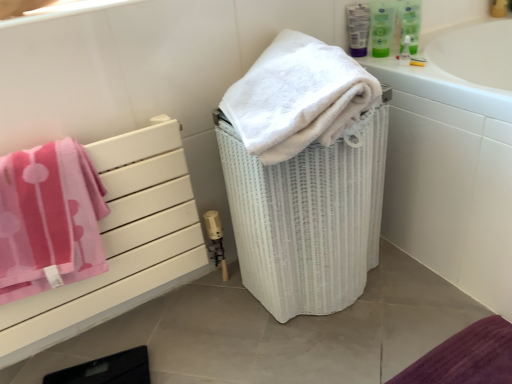
The height and width of the screenshot is (384, 512). In order to click on translucent plastic mouthwash at upper right, which is the 1th mouthwash in left-to-right order in this screenshot , I will do `click(358, 29)`.

How much space does translucent plastic mouthwash at upper right, which is the 1th mouthwash in left-to-right order, occupy horizontally?

1.83 inches.

Locate an element on the screen. The image size is (512, 384). pink terry cloth towel at left, positioned as the 1th towel in left-to-right order is located at coordinates (49, 219).

Measure the distance between point (5, 222) and camera.

Point (5, 222) and camera are 85.50 centimeters apart.

Measure the distance between white glossy bathtub at upper right and camera.

The depth of white glossy bathtub at upper right is 34.99 inches.

This screenshot has width=512, height=384. What do you see at coordinates (382, 26) in the screenshot? I see `green plastic mouthwash at upper right, which appears as the 2th mouthwash when viewed from the right` at bounding box center [382, 26].

Locate an element on the screen. Image resolution: width=512 pixels, height=384 pixels. translucent plastic mouthwash at upper right, which is the 1th mouthwash in left-to-right order is located at coordinates (358, 29).

Would you say translucent plastic mouthwash at upper right, which is the 1th mouthwash in left-to-right order, is outside pink terry cloth towel at left, positioned as the 1th towel in left-to-right order?

Indeed, translucent plastic mouthwash at upper right, which is the 1th mouthwash in left-to-right order, is completely outside pink terry cloth towel at left, positioned as the 1th towel in left-to-right order.

Relative to pink terry cloth towel at left, positioned as the 1th towel in left-to-right order, is translucent plastic mouthwash at upper right, acting as the third mouthwash starting from the right, in front or behind?

translucent plastic mouthwash at upper right, acting as the third mouthwash starting from the right, is behind pink terry cloth towel at left, positioned as the 1th towel in left-to-right order.

In the scene shown: Considering the sizes of objects translucent plastic mouthwash at upper right, which is the 1th mouthwash in left-to-right order, and pink terry cloth towel at left, which appears as the second towel when viewed from the right, in the image provided, who is wider, translucent plastic mouthwash at upper right, which is the 1th mouthwash in left-to-right order, or pink terry cloth towel at left, which appears as the second towel when viewed from the right,?

pink terry cloth towel at left, which appears as the second towel when viewed from the right, is wider.

In terms of height, does green plastic mouthwash at upper right, which appears as the 2th mouthwash when viewed from the right, look taller or shorter compared to pink terry cloth towel at left, positioned as the 1th towel in left-to-right order?

In the image, green plastic mouthwash at upper right, which appears as the 2th mouthwash when viewed from the right, appears to be shorter than pink terry cloth towel at left, positioned as the 1th towel in left-to-right order.

Considering the positions of objects green plastic mouthwash at upper right, which appears as the 2th mouthwash when viewed from the right, and pink terry cloth towel at left, which appears as the second towel when viewed from the right, in the image provided, who is more to the right, green plastic mouthwash at upper right, which appears as the 2th mouthwash when viewed from the right, or pink terry cloth towel at left, which appears as the second towel when viewed from the right,?

green plastic mouthwash at upper right, which appears as the 2th mouthwash when viewed from the right.

Which mouthwash is the 2nd one when counting from the right side of the pink terry cloth towel at left, which appears as the second towel when viewed from the right? Please provide its 2D coordinates.

[(382, 26)]

Considering the relative sizes of green plastic mouthwash at upper right, arranged as the 2th mouthwash when viewed from the left, and pink terry cloth towel at left, which appears as the second towel when viewed from the right, in the image provided, is green plastic mouthwash at upper right, arranged as the 2th mouthwash when viewed from the left, wider than pink terry cloth towel at left, which appears as the second towel when viewed from the right,?

In fact, green plastic mouthwash at upper right, arranged as the 2th mouthwash when viewed from the left, might be narrower than pink terry cloth towel at left, which appears as the second towel when viewed from the right.

From a real-world perspective, is translucent plastic mouthwash at upper right, acting as the third mouthwash starting from the right, physically located above or below white glossy bathtub at upper right?

From a real-world perspective, translucent plastic mouthwash at upper right, acting as the third mouthwash starting from the right, is physically above white glossy bathtub at upper right.

Is translucent plastic mouthwash at upper right, acting as the third mouthwash starting from the right, inside the boundaries of white glossy bathtub at upper right, or outside?

translucent plastic mouthwash at upper right, acting as the third mouthwash starting from the right, cannot be found inside white glossy bathtub at upper right.

From the image's perspective, does translucent plastic mouthwash at upper right, acting as the third mouthwash starting from the right, appear higher than white glossy bathtub at upper right?

Correct, translucent plastic mouthwash at upper right, acting as the third mouthwash starting from the right, appears higher than white glossy bathtub at upper right in the image.

Considering the relative sizes of translucent plastic mouthwash at upper right, which is the 1th mouthwash in left-to-right order, and white glossy bathtub at upper right in the image provided, is translucent plastic mouthwash at upper right, which is the 1th mouthwash in left-to-right order, bigger than white glossy bathtub at upper right?

No, translucent plastic mouthwash at upper right, which is the 1th mouthwash in left-to-right order, is not bigger than white glossy bathtub at upper right.

Which is in front, point (195, 233) or point (356, 51)?

The point (195, 233) is in front.

Considering the relative sizes of pink fabric towel at left and translucent plastic mouthwash at upper right, which is the 1th mouthwash in left-to-right order, in the image provided, is pink fabric towel at left smaller than translucent plastic mouthwash at upper right, which is the 1th mouthwash in left-to-right order,?

No.

Would you say pink fabric towel at left is inside or outside translucent plastic mouthwash at upper right, which is the 1th mouthwash in left-to-right order?

pink fabric towel at left is not enclosed by translucent plastic mouthwash at upper right, which is the 1th mouthwash in left-to-right order.

The image size is (512, 384). I want to click on drawer that appears below the translucent plastic mouthwash at upper right, which is the 1th mouthwash in left-to-right order (from the image's perspective), so click(120, 243).

Considering the sizes of objects pink fabric towel at left and green plastic mouthwash at upper right, which appears as the 2th mouthwash when viewed from the right, in the image provided, who is thinner, pink fabric towel at left or green plastic mouthwash at upper right, which appears as the 2th mouthwash when viewed from the right,?

With smaller width is green plastic mouthwash at upper right, which appears as the 2th mouthwash when viewed from the right.

Where is `the 1st mouthwash above the pink fabric towel at left (from the image's perspective)`? the 1st mouthwash above the pink fabric towel at left (from the image's perspective) is located at coordinates (382, 26).

Measure the distance between pink fabric towel at left and green plastic mouthwash at upper right, which appears as the 2th mouthwash when viewed from the right.

34.12 inches.

Is pink fabric towel at left placed right next to green plastic mouthwash at upper right, arranged as the 2th mouthwash when viewed from the left?

No, pink fabric towel at left is not next to green plastic mouthwash at upper right, arranged as the 2th mouthwash when viewed from the left.

Is pink terry cloth towel at left, which appears as the second towel when viewed from the right, with white wicker laundry basket at center?

No, pink terry cloth towel at left, which appears as the second towel when viewed from the right, is not making contact with white wicker laundry basket at center.

Does pink terry cloth towel at left, positioned as the 1th towel in left-to-right order, contain white wicker laundry basket at center?

Actually, white wicker laundry basket at center is outside pink terry cloth towel at left, positioned as the 1th towel in left-to-right order.

From the image's perspective, which is below, pink terry cloth towel at left, positioned as the 1th towel in left-to-right order, or white wicker laundry basket at center?

From the image's view, pink terry cloth towel at left, positioned as the 1th towel in left-to-right order, is below.

Does pink terry cloth towel at left, which appears as the second towel when viewed from the right, come behind white wicker laundry basket at center?

No, the depth of pink terry cloth towel at left, which appears as the second towel when viewed from the right, is less than that of white wicker laundry basket at center.

Consider the image. From the image's perspective, does green plastic mouthwash at upper right, which appears as the 2th mouthwash when viewed from the right, appear lower than green plastic mouthwash at upper right, acting as the 1th mouthwash starting from the right?

Correct, green plastic mouthwash at upper right, which appears as the 2th mouthwash when viewed from the right, appears lower than green plastic mouthwash at upper right, acting as the 1th mouthwash starting from the right, in the image.

Between green plastic mouthwash at upper right, arranged as the 2th mouthwash when viewed from the left, and green plastic mouthwash at upper right, acting as the 1th mouthwash starting from the right, which one has more height?

green plastic mouthwash at upper right, acting as the 1th mouthwash starting from the right, is taller.

Which is more to the left, green plastic mouthwash at upper right, arranged as the 2th mouthwash when viewed from the left, or green plastic mouthwash at upper right, arranged as the third mouthwash when viewed from the left?

Positioned to the left is green plastic mouthwash at upper right, arranged as the 2th mouthwash when viewed from the left.

You are a GUI agent. You are given a task and a screenshot of the screen. Output one action in this format:
    pyautogui.click(x=<x>, y=<y>)
    Task: Click on the towel that is the 1st object located in front of the translucent plastic mouthwash at upper right, which is the 1th mouthwash in left-to-right order
    The image size is (512, 384).
    Given the screenshot: What is the action you would take?
    pyautogui.click(x=49, y=219)

Where is `the 2nd towel below the green plastic mouthwash at upper right, arranged as the 2th mouthwash when viewed from the left (from the image's perspective)`? The image size is (512, 384). the 2nd towel below the green plastic mouthwash at upper right, arranged as the 2th mouthwash when viewed from the left (from the image's perspective) is located at coordinates (49, 219).

Looking at this image, from the image, which object appears to be nearer to green plastic mouthwash at upper right, acting as the 1th mouthwash starting from the right, white fluffy towel at upper right, positioned as the second towel in left-to-right order, or white glossy bathtub at upper right?

white glossy bathtub at upper right is closer to green plastic mouthwash at upper right, acting as the 1th mouthwash starting from the right.

From the image, which object appears to be farther from green plastic mouthwash at upper right, arranged as the third mouthwash when viewed from the left, translucent plastic mouthwash at upper right, acting as the third mouthwash starting from the right, or pink fabric towel at left?

pink fabric towel at left lies further to green plastic mouthwash at upper right, arranged as the third mouthwash when viewed from the left, than the other object.

Based on the photo, based on their spatial positions, is pink terry cloth towel at left, positioned as the 1th towel in left-to-right order, or white glossy bathtub at upper right further from white fluffy towel at upper right, which ranks as the first towel in right-to-left order?

pink terry cloth towel at left, positioned as the 1th towel in left-to-right order, is further to white fluffy towel at upper right, which ranks as the first towel in right-to-left order.

Based on their spatial positions, is white fluffy towel at upper right, which ranks as the first towel in right-to-left order, or pink terry cloth towel at left, which appears as the second towel when viewed from the right, closer to white glossy bathtub at upper right?

Among the two, white fluffy towel at upper right, which ranks as the first towel in right-to-left order, is located nearer to white glossy bathtub at upper right.

Based on their spatial positions, is green plastic mouthwash at upper right, which appears as the 2th mouthwash when viewed from the right, or translucent plastic mouthwash at upper right, acting as the third mouthwash starting from the right, closer to white wicker laundry basket at center?

green plastic mouthwash at upper right, which appears as the 2th mouthwash when viewed from the right, is closer to white wicker laundry basket at center.

When comparing their distances from white wicker laundry basket at center, does green plastic mouthwash at upper right, which appears as the 2th mouthwash when viewed from the right, or green plastic mouthwash at upper right, arranged as the third mouthwash when viewed from the left, seem closer?

green plastic mouthwash at upper right, arranged as the third mouthwash when viewed from the left, is positioned closer to the anchor white wicker laundry basket at center.

Consider the image. Considering their positions, is pink terry cloth towel at left, which appears as the second towel when viewed from the right, positioned closer to pink fabric towel at left than green plastic mouthwash at upper right, arranged as the third mouthwash when viewed from the left?

pink terry cloth towel at left, which appears as the second towel when viewed from the right, is positioned closer to the anchor pink fabric towel at left.

Looking at the image, which one is located further to white glossy bathtub at upper right, green plastic mouthwash at upper right, which appears as the 2th mouthwash when viewed from the right, or green plastic mouthwash at upper right, acting as the 1th mouthwash starting from the right?

green plastic mouthwash at upper right, which appears as the 2th mouthwash when viewed from the right, is positioned further to the anchor white glossy bathtub at upper right.

Locate an element on the screen. This screenshot has height=384, width=512. towel situated between pink fabric towel at left and white wicker laundry basket at center from left to right is located at coordinates (298, 97).

Where is `laundry basket situated between pink fabric towel at left and white glossy bathtub at upper right from left to right`? Image resolution: width=512 pixels, height=384 pixels. laundry basket situated between pink fabric towel at left and white glossy bathtub at upper right from left to right is located at coordinates (308, 216).

This screenshot has height=384, width=512. In order to click on laundry basket between white fluffy towel at upper right, positioned as the second towel in left-to-right order, and white glossy bathtub at upper right, in the horizontal direction in this screenshot , I will do (308, 216).

The height and width of the screenshot is (384, 512). I want to click on drawer situated between pink terry cloth towel at left, which appears as the second towel when viewed from the right, and white wicker laundry basket at center from left to right, so click(x=120, y=243).